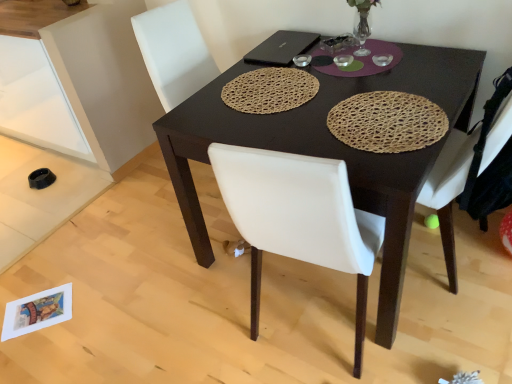
Question: From their relative heights in the image, would you say woven brown placemat at center, the 1th mat positioned from the left, is taller or shorter than black matte laptop at upper center?

Choices:
 (A) short
 (B) tall

Answer: (B)

Question: From a real-world perspective, is woven brown placemat at center, the 1th mat positioned from the left, above or below black matte laptop at upper center?

Choices:
 (A) above
 (B) below

Answer: (B)

Question: Considering the real-world distances, which object is closest to the dark brown wooden desk at center?

Choices:
 (A) white leather chair at right
 (B) woven brown placemat at center, the 1th mat positioned from the left
 (C) woven straw placemat at center, the 2th mat when ordered from left to right
 (D) matte white cabinet at lower left
 (E) black matte laptop at upper center

Answer: (C)

Question: Estimate the real-world distances between objects in this image. Which object is closer to the woven brown placemat at center, the 2th mat from the right?

Choices:
 (A) matte white cabinet at lower left
 (B) woven straw placemat at center, the 2th mat when ordered from left to right
 (C) white leather chair at right
 (D) dark brown wooden desk at center
 (E) black matte laptop at upper center

Answer: (E)